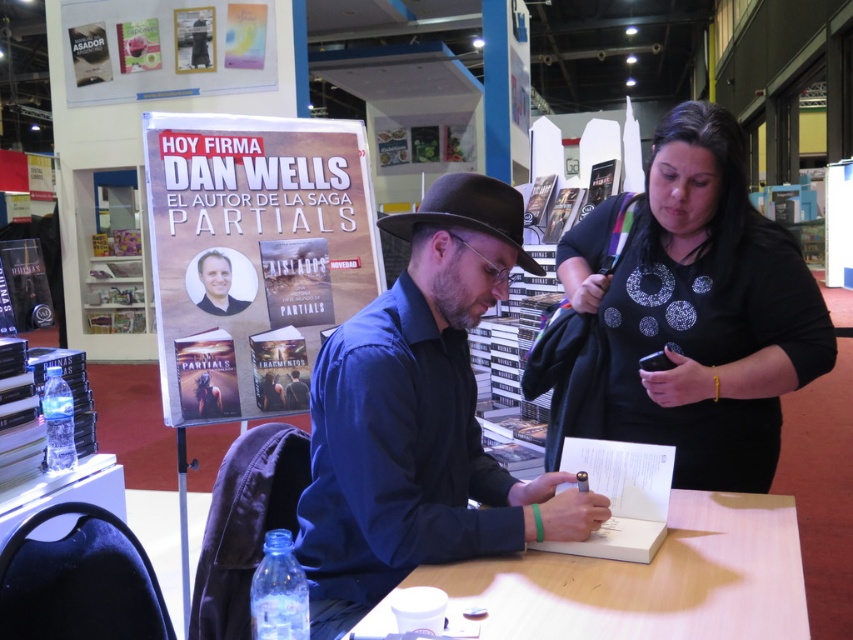
You are attending a book signing event and notice the blue cotton shirt at center and the light brown wooden table at center. Which object is positioned higher from the ground?

The blue cotton shirt at center is above the light brown wooden table at center, so it is positioned higher from the ground.

Based on the scene described, where is the black matte shirt at center in relation to the matte paper poster at upper left?

The black matte shirt at center is to the right of the matte paper poster at upper left.